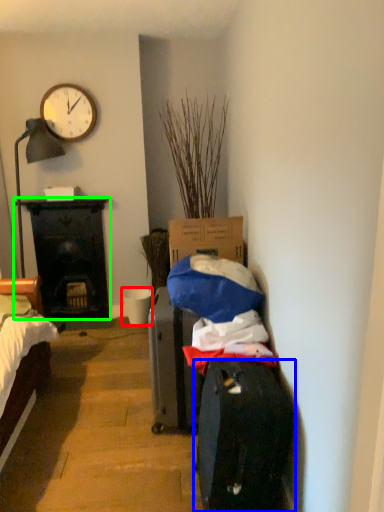
Question: Considering the real-world distances, which object is closest to bucket (highlighted by a red box)? luggage and bags (highlighted by a blue box) or desk (highlighted by a green box).

Choices:
 (A) luggage and bags
 (B) desk

Answer: (B)